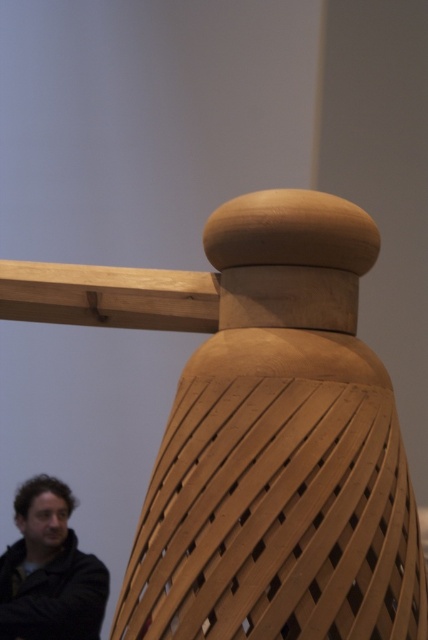
You are standing in front of the sculpture and want to sit down on the natural wood chair at center without moving the person in the dark brown leather jacket at lower left. Is this possible?

The natural wood chair at center is to the right of the dark brown leather jacket at lower left, so you can sit on the natural wood chair at center without moving the person as they are positioned to your left.

You are a furniture designer who wants to place a new table between the natural wood chair at center and the dark brown leather jacket at lower left. What is the minimum length the table should be to fit between them?

The natural wood chair at center and dark brown leather jacket at lower left are 6.16 feet apart from each other, so the table should be at least 6.16 feet long to fit between them.